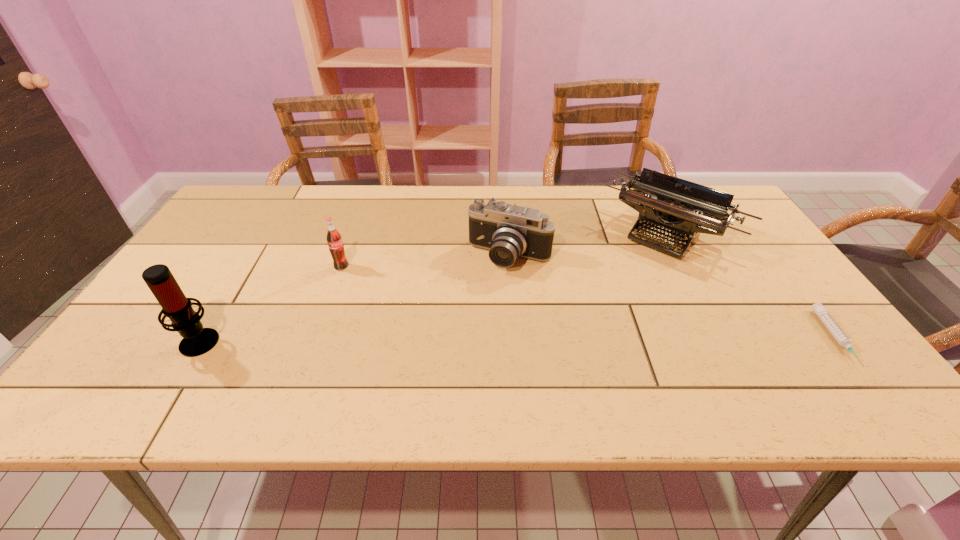
Identify the location of object that is at the left edge. The height and width of the screenshot is (540, 960). (197, 340).

The height and width of the screenshot is (540, 960). I want to click on syringe that is at the right edge, so click(821, 311).

Where is `typewriter located at the right edge`? This screenshot has height=540, width=960. typewriter located at the right edge is located at coordinates (681, 208).

Find the location of a particular element. object at the near left corner is located at coordinates (197, 340).

You are a GUI agent. You are given a task and a screenshot of the screen. Output one action in this format:
    pyautogui.click(x=<x>, y=<y>)
    Task: Click on the object situated at the far right corner
    This screenshot has width=960, height=540.
    Given the screenshot: What is the action you would take?
    pyautogui.click(x=681, y=208)

Where is `object that is at the near right corner`? object that is at the near right corner is located at coordinates (821, 311).

Locate an element on the screen. Image resolution: width=960 pixels, height=540 pixels. free space at the far edge is located at coordinates (310, 219).

Locate an element on the screen. free space at the near edge of the desktop is located at coordinates (229, 354).

Where is `vacant area at the left edge`? The width and height of the screenshot is (960, 540). vacant area at the left edge is located at coordinates (142, 337).

The width and height of the screenshot is (960, 540). I want to click on free space at the right edge, so click(768, 329).